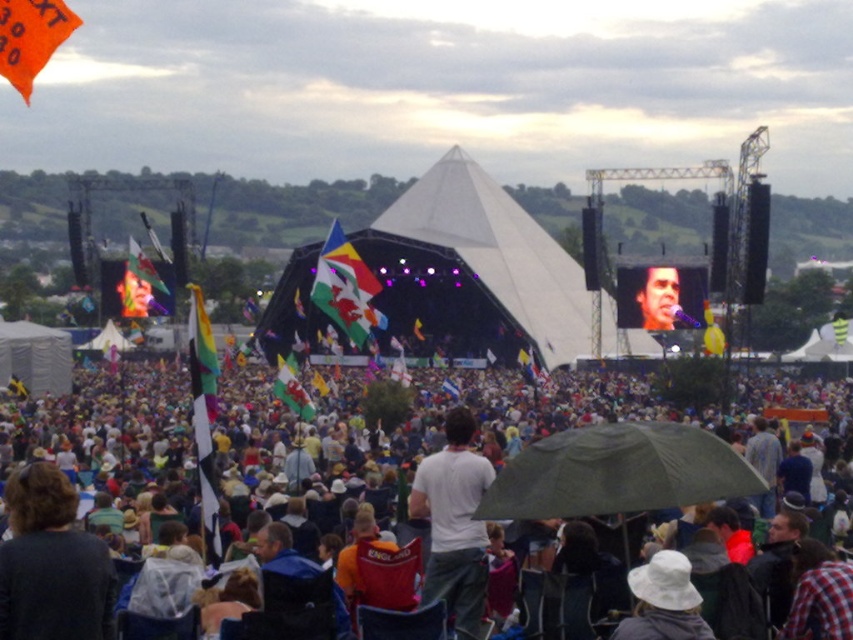
You are a photographer at the concert and want to capture a photo of the white cotton shirt at center without the white fabric crowd at center blocking it. What should you do?

The white fabric crowd at center is located above the white cotton shirt at center, so you should lower your camera angle to avoid the white fabric crowd at center blocking the view of the white cotton shirt at center.

You are a photographer positioned at the center of the concert venue. You want to capture both the point at coordinates point (225, 406) and point (421, 604) in your shot. Which point is closer to your current position?

Point (225, 406) is closer to your current position because it is further to the viewer than point (421, 604).

You are a photographer at the concert and want to position yourself at point (618, 472) to capture the stage. Is there an object at that location that might block your view?

Yes, there is a green matte umbrella at center located at point (618, 472), which would block your view.